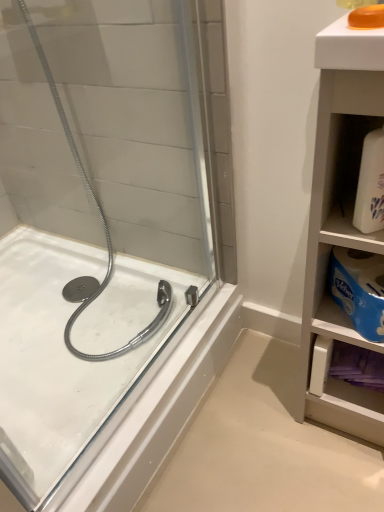
Question: From the image's perspective, is translucent orange soap at upper right under white glossy bath at left?

Choices:
 (A) no
 (B) yes

Answer: (A)

Question: Is translucent orange soap at upper right in front of white glossy bath at left?

Choices:
 (A) yes
 (B) no

Answer: (A)

Question: From a real-world perspective, is translucent orange soap at upper right under white glossy bath at left?

Choices:
 (A) no
 (B) yes

Answer: (A)

Question: Does translucent orange soap at upper right have a lesser height compared to white glossy bath at left?

Choices:
 (A) yes
 (B) no

Answer: (A)

Question: Considering the relative sizes of translucent orange soap at upper right and white glossy bath at left in the image provided, is translucent orange soap at upper right bigger than white glossy bath at left?

Choices:
 (A) yes
 (B) no

Answer: (B)

Question: Considering their positions, is white glossy bath at left located in front of or behind white matte cabinet at right?

Choices:
 (A) behind
 (B) front

Answer: (A)

Question: Is point (31, 462) closer or farther from the camera than point (345, 388)?

Choices:
 (A) farther
 (B) closer

Answer: (B)

Question: From a real-world perspective, is white glossy bath at left above or below white matte cabinet at right?

Choices:
 (A) above
 (B) below

Answer: (B)

Question: From the image's perspective, is white glossy bath at left located above or below white matte cabinet at right?

Choices:
 (A) above
 (B) below

Answer: (B)

Question: Relative to translucent orange soap at upper right, is white matte cabinet at right in front or behind?

Choices:
 (A) behind
 (B) front

Answer: (B)

Question: From the image's perspective, is white matte cabinet at right located above or below translucent orange soap at upper right?

Choices:
 (A) above
 (B) below

Answer: (B)

Question: Is point (380, 232) closer or farther from the camera than point (374, 17)?

Choices:
 (A) farther
 (B) closer

Answer: (A)

Question: Would you say white matte cabinet at right is to the left or to the right of translucent orange soap at upper right in the picture?

Choices:
 (A) left
 (B) right

Answer: (B)

Question: Is white matte bottle at right in front of or behind translucent orange soap at upper right in the image?

Choices:
 (A) front
 (B) behind

Answer: (B)

Question: Is white matte bottle at right wider or thinner than translucent orange soap at upper right?

Choices:
 (A) thin
 (B) wide

Answer: (A)